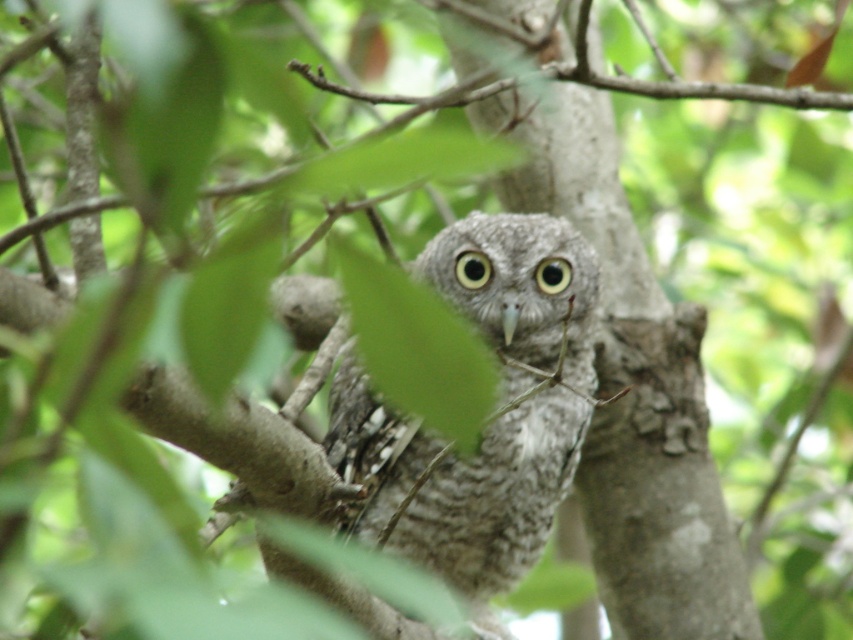
You are an ornithologist observing the speckled gray owl at center and the yellow matte eye at center. Which object is closer to you?

The speckled gray owl at center is closer to the viewer than the yellow matte eye at center.

You are an ornithologist observing the speckled gray owl at center and the black matte eye at center in the image. Which object is taller?

The speckled gray owl at center is taller than the black matte eye at center.

You are a wildlife photographer trying to capture a closeup of the owl. You want to focus on both the black matte eye at center and the yellow matte eye at center in the same shot. What is the minimum distance your camera lens should be able to focus on to ensure both eyes are in focus?

The black matte eye at center is 4.23 inches from the yellow matte eye at center. To ensure both eyes are in focus, the camera lens should be able to focus on a subject distance that accommodates this separation. Typically, the minimum focusing distance should be at least half the distance between the two eyes, so approximately 2.115 inches or closer.